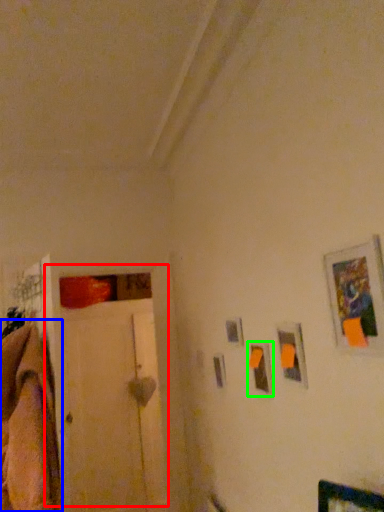
Question: Based on their relative distances, which object is nearer to door (highlighted by a red box)? Choose from blanket (highlighted by a blue box) and picture frame (highlighted by a green box).

Choices:
 (A) blanket
 (B) picture frame

Answer: (A)